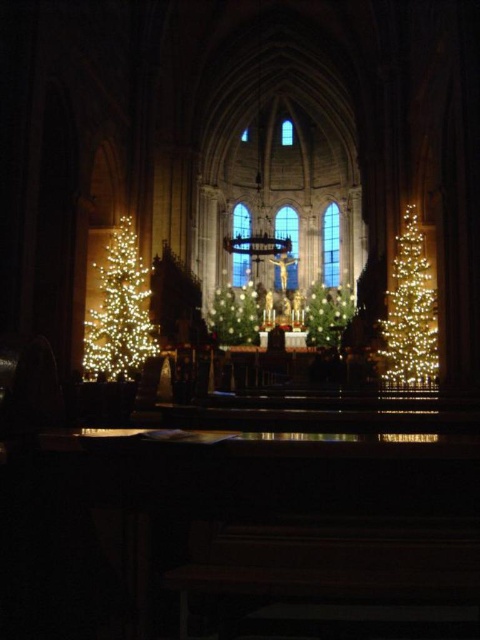
You are standing at the camera position and want to know if you can see the illuminated plastic christmas tree at left from where you are. The cathedral is 100 meters long. Can you see the tree?

The illuminated plastic christmas tree at left and camera are 68.08 meters apart, so yes, you can see the tree from the camera position since the distance is less than the cathedral length of 100 meters.

You are standing at the entrance of the cathedral and looking towards the altar. Where is the illuminated plastic christmas tree at left located relative to your position?

The illuminated plastic christmas tree at left is located at the left side of the cathedral, positioned at coordinates approximately 0.484 on the x axis and 0.248 on the y axis relative to your position at the entrance.

You are standing at the entrance of the cathedral and want to place a new decoration between the green matte christmas tree at center and the illuminated artificial christmas tree at center. How far apart are these two trees from each other?

The green matte christmas tree at center and the illuminated artificial christmas tree at center are 12.43 meters apart.